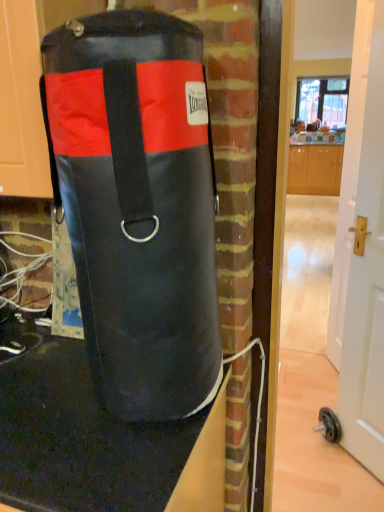
Question: Considering the positions of point (299, 101) and point (132, 493), is point (299, 101) closer or farther from the camera than point (132, 493)?

Choices:
 (A) farther
 (B) closer

Answer: (A)

Question: From a real-world perspective, is transparent glass window at upper center physically located above or below black rubber mat at lower left?

Choices:
 (A) below
 (B) above

Answer: (B)

Question: Which object is positioned closest to the black leather punching bag at center?

Choices:
 (A) transparent glass window at upper center
 (B) white glossy door at center right
 (C) black rubber mat at lower left

Answer: (C)

Question: Which object is positioned farthest from the white glossy door at center right?

Choices:
 (A) black rubber mat at lower left
 (B) black leather punching bag at center
 (C) transparent glass window at upper center

Answer: (C)